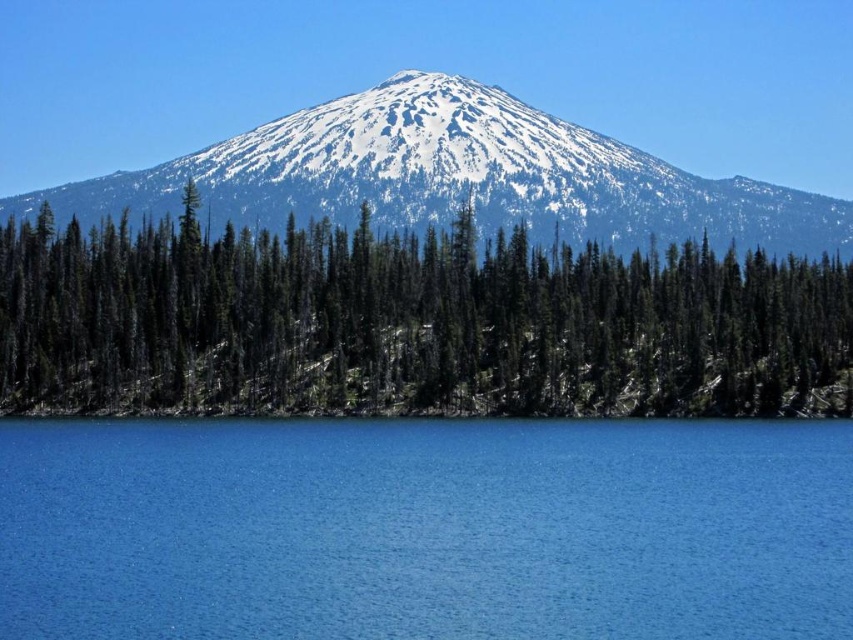
Which of these two, blue liquid at lower center or snowy white mountain at center, stands taller?

Standing taller between the two is snowy white mountain at center.

Does blue liquid at lower center appear under snowy white mountain at center?

Yes, blue liquid at lower center is below snowy white mountain at center.

Who is more distant from viewer, (277, 614) or (613, 202)?

Positioned behind is point (613, 202).

Image resolution: width=853 pixels, height=640 pixels. I want to click on blue liquid at lower center, so click(x=425, y=529).

Does blue liquid at lower center have a lesser width compared to green textured trees at center?

Indeed, blue liquid at lower center has a lesser width compared to green textured trees at center.

Measure the distance between point (228, 486) and camera.

Point (228, 486) and camera are 86.83 meters apart.

This screenshot has height=640, width=853. In order to click on blue liquid at lower center in this screenshot , I will do `click(425, 529)`.

Can you confirm if green textured trees at center is positioned above snowy white mountain at center?

Incorrect, green textured trees at center is not positioned above snowy white mountain at center.

Does green textured trees at center appear under snowy white mountain at center?

Correct, green textured trees at center is located below snowy white mountain at center.

Locate an element on the screen. green textured trees at center is located at coordinates (409, 324).